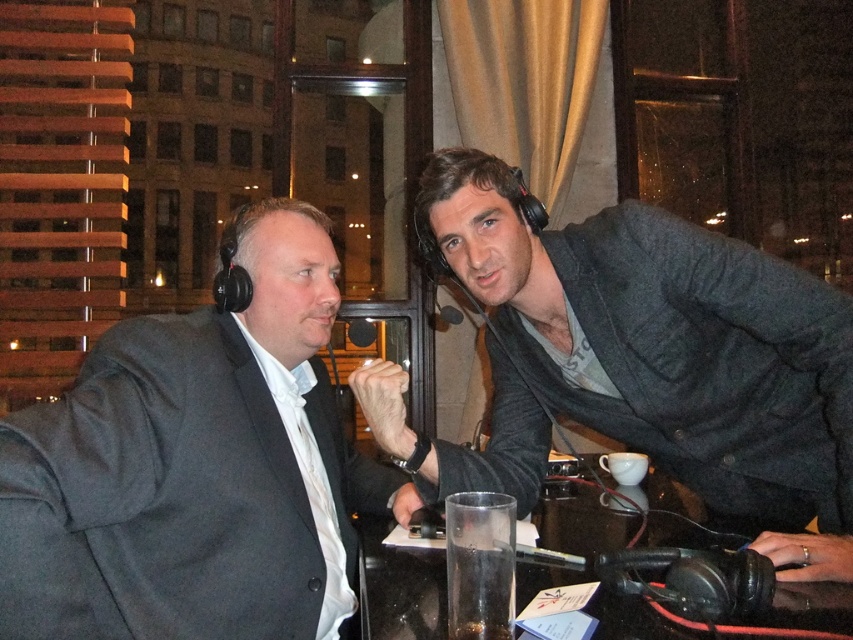
You are a photographer planning to take a portrait of the two people at the table. The matte black suit at left and the transparent glass at center are both in the frame. Since you want to ensure the subject is in focus, which object should you prioritize focusing on, considering their thickness?

The matte black suit at left is thinner than the transparent glass at center, so you should prioritize focusing on the transparent glass at center because thicker objects often require more precise focus to ensure clarity.

You are standing in front of the table where the podcast recording is happening. There is a transparent glass at center. Where exactly is the transparent glass located in terms of coordinates? Please provide the coordinates in the format of a point like point (399, 586).

The transparent glass at center is located at point (399, 586).

You are a photographer trying to capture a clear shot of the dark gray textured blazer at right without including the transparent glass at center in the frame. Based on their positions, is this possible?

The dark gray textured blazer at right is positioned on the right side of the transparent glass at center, so it is possible to capture a clear shot of the dark gray textured blazer at right without including the transparent glass at center by focusing on the right side of the frame.